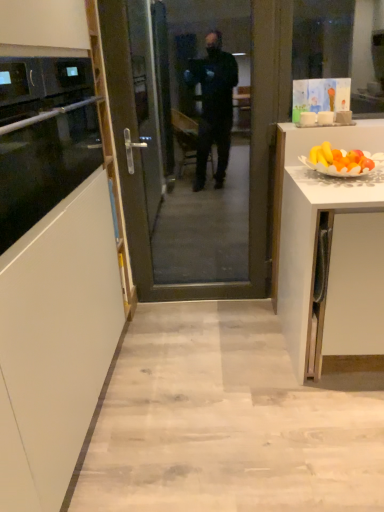
Question: Can you confirm if transparent glass door at center is bigger than black glass oven at left?

Choices:
 (A) yes
 (B) no

Answer: (A)

Question: Is transparent glass door at center taller than black glass oven at left?

Choices:
 (A) no
 (B) yes

Answer: (B)

Question: Can you confirm if transparent glass door at center is smaller than black glass oven at left?

Choices:
 (A) no
 (B) yes

Answer: (A)

Question: Is transparent glass door at center far from black glass oven at left?

Choices:
 (A) no
 (B) yes

Answer: (B)

Question: From the image's perspective, is transparent glass door at center located above black glass oven at left?

Choices:
 (A) yes
 (B) no

Answer: (B)

Question: Is transparent glass door at center outside of black glass oven at left?

Choices:
 (A) yes
 (B) no

Answer: (A)

Question: From the image's perspective, is black glass oven at left beneath transparent glass door at center?

Choices:
 (A) yes
 (B) no

Answer: (B)

Question: From the image's perspective, is black glass oven at left on top of transparent glass door at center?

Choices:
 (A) no
 (B) yes

Answer: (B)

Question: Is black glass oven at left outside of transparent glass door at center?

Choices:
 (A) no
 (B) yes

Answer: (B)

Question: Can you confirm if black glass oven at left is thinner than transparent glass door at center?

Choices:
 (A) yes
 (B) no

Answer: (B)

Question: From a real-world perspective, is black glass oven at left below transparent glass door at center?

Choices:
 (A) no
 (B) yes

Answer: (A)

Question: Considering the relative sizes of black glass oven at left and transparent glass door at center in the image provided, is black glass oven at left wider than transparent glass door at center?

Choices:
 (A) yes
 (B) no

Answer: (A)

Question: Is transparent glass door at center taller or shorter than black glass oven at left?

Choices:
 (A) short
 (B) tall

Answer: (B)